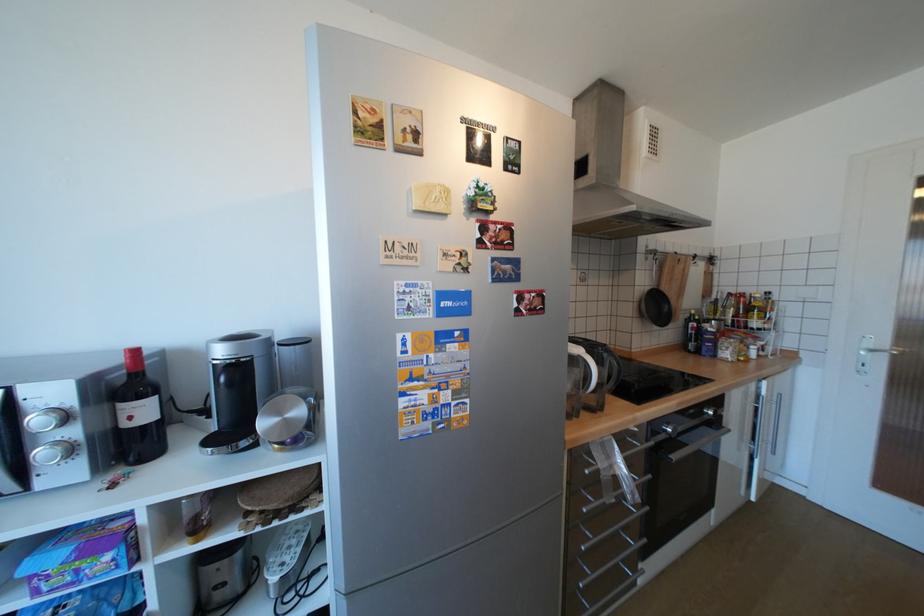
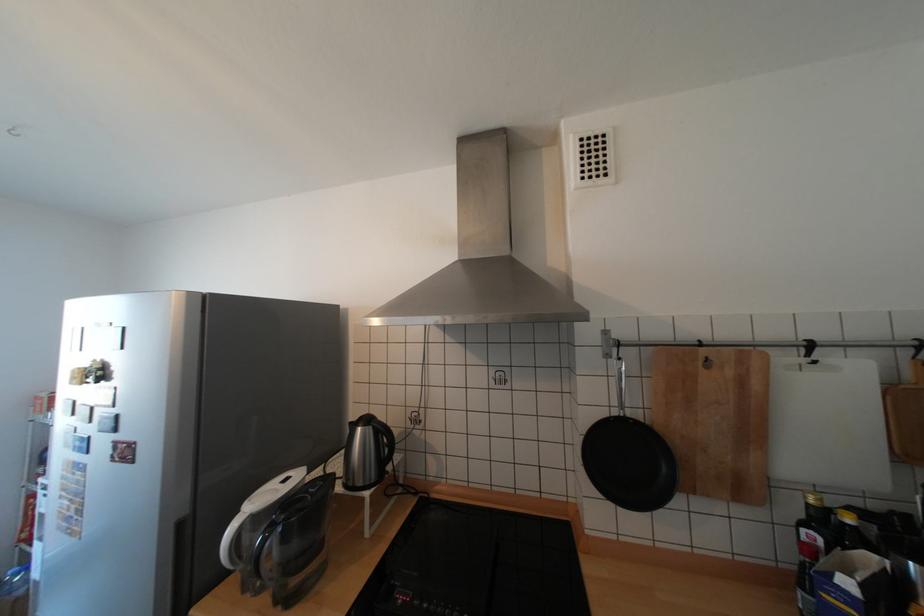
The point at [704,262] is marked in the first image. Where is the corresponding point in the second image?

(823, 362)